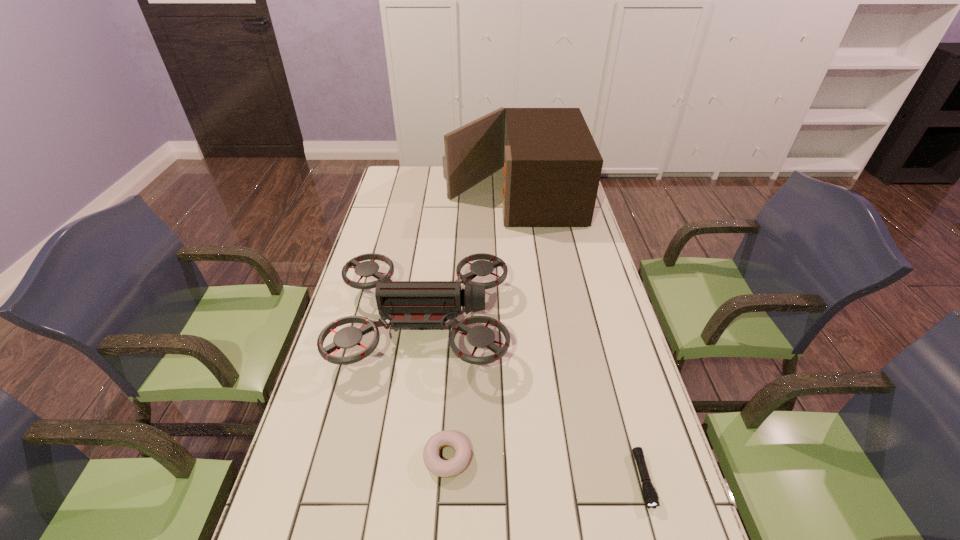
You are a GUI agent. You are given a task and a screenshot of the screen. Output one action in this format:
    pyautogui.click(x=<x>, y=<y>)
    Task: Click on the tallest object
    The height and width of the screenshot is (540, 960).
    Given the screenshot: What is the action you would take?
    pyautogui.click(x=552, y=166)

At what (x,y) coordinates should I click in order to perform the action: click on the farthest object. Please return your answer as a coordinate pair (x, y). The height and width of the screenshot is (540, 960). Looking at the image, I should click on (552, 166).

Identify the location of the second farthest object. This screenshot has height=540, width=960. (406, 304).

Image resolution: width=960 pixels, height=540 pixels. What are the coordinates of `drone` in the screenshot? It's located at (406, 304).

Locate an element on the screen. This screenshot has width=960, height=540. doughnut is located at coordinates (442, 468).

The width and height of the screenshot is (960, 540). In order to click on the shortest object in this screenshot , I will do `click(650, 496)`.

The width and height of the screenshot is (960, 540). I want to click on vacant space situated with the door open on the front of the tallest object, so click(401, 195).

Find the location of a particular element. This screenshot has width=960, height=540. vacant space located on the front-facing side of the third shortest object is located at coordinates (623, 322).

Image resolution: width=960 pixels, height=540 pixels. I want to click on free location located 0.110m on the left of the doughnut, so click(x=376, y=457).

Where is `object at the far edge`? object at the far edge is located at coordinates (552, 166).